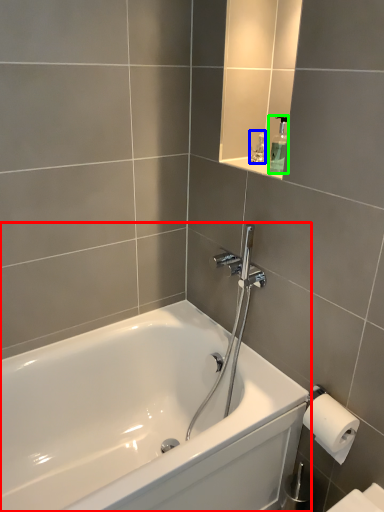
Question: Based on their relative distances, which object is farther from bathtub (highlighted by a red box)? Choose from toiletry (highlighted by a blue box) and soap dispenser (highlighted by a green box).

Choices:
 (A) toiletry
 (B) soap dispenser

Answer: (A)